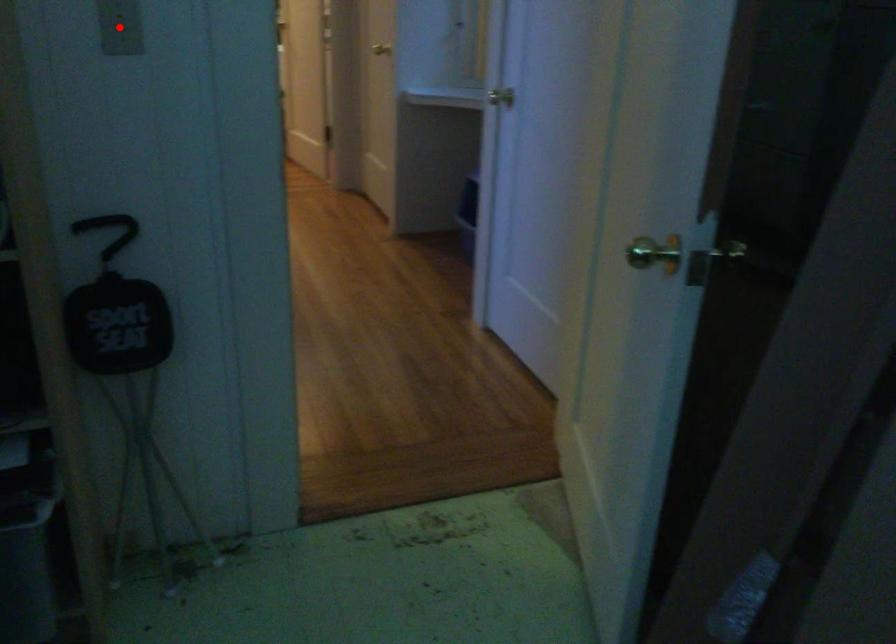
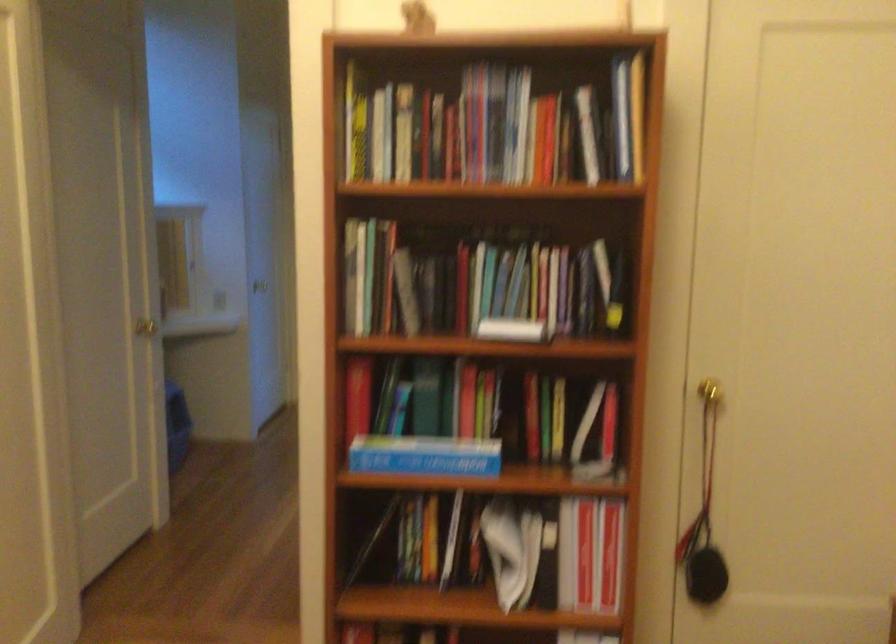
Question: I am providing you with two images of the same scene from different viewpoints. A red point is marked on the first image. Can you still see the location of the red point in image 2?

Choices:
 (A) Yes
 (B) No

Answer: (B)